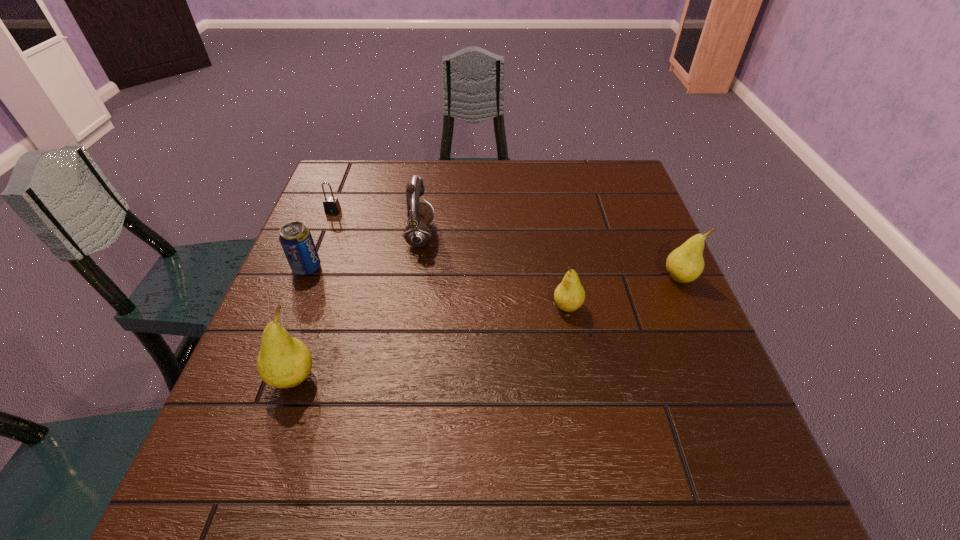
In order to click on free space between the soda and the third object from right to left in this screenshot , I will do [364, 252].

Where is `free space that is in between the farthest object and the soda`? Image resolution: width=960 pixels, height=540 pixels. free space that is in between the farthest object and the soda is located at coordinates (320, 239).

Locate an element on the screen. empty location between the nearest pear and the soda is located at coordinates (300, 323).

Locate an element on the screen. This screenshot has height=540, width=960. empty location between the nearest pear and the shortest object is located at coordinates (313, 295).

Find the location of a particular element. This screenshot has width=960, height=540. vacant area between the third object from right to left and the nearest pear is located at coordinates (357, 307).

At what (x,y) coordinates should I click in order to perform the action: click on free spot between the farthest object and the fifth object from left to right. Please return your answer as a coordinate pair (x, y). The width and height of the screenshot is (960, 540). Looking at the image, I should click on (450, 259).

The width and height of the screenshot is (960, 540). Identify the location of free spot between the farthest object and the fourth object from left to right. (376, 223).

In order to click on vacant space that's between the nearest pear and the fifth farthest object in this screenshot , I will do click(x=430, y=343).

Locate an element on the screen. free space that is in between the nearest pear and the fourth object from left to right is located at coordinates (357, 307).

Identify which object is the fifth closest to the farthest pear. Please provide its 2D coordinates. Your answer should be formatted as a tuple, i.e. [(x, y)], where the tuple contains the x and y coordinates of a point satisfying the conditions above.

[(331, 204)]